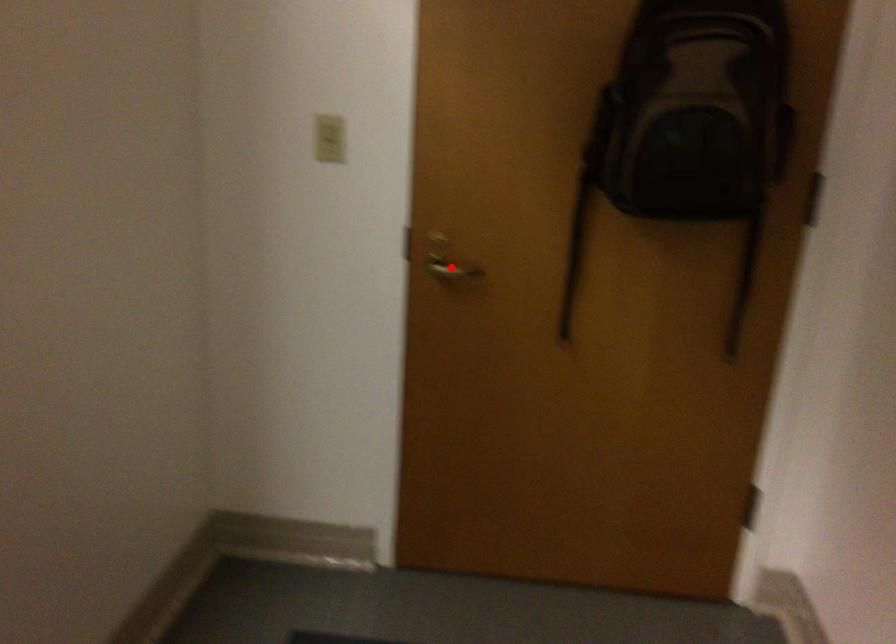
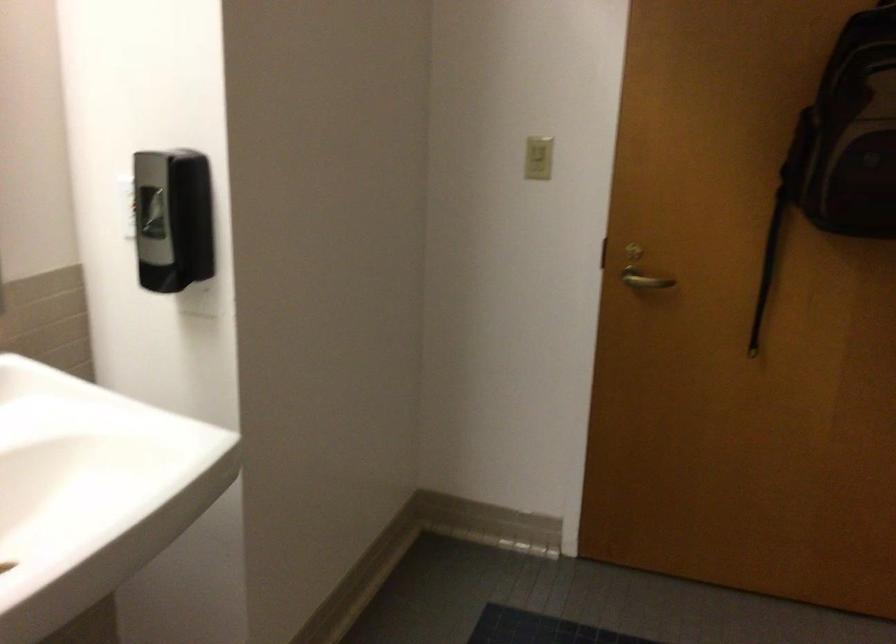
Find the pixel in the second image that matches the highlighted location in the first image.

(643, 279)